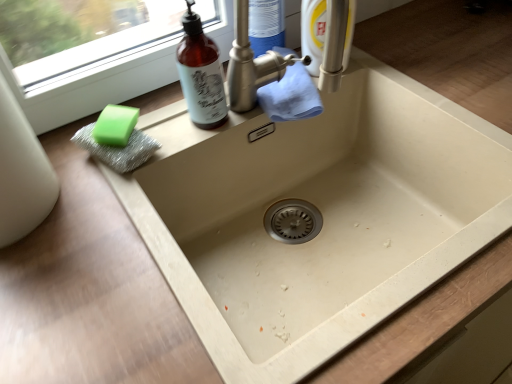
Find the location of a particular element. The width and height of the screenshot is (512, 384). free space in front of brown glass bottle at upper left is located at coordinates (158, 167).